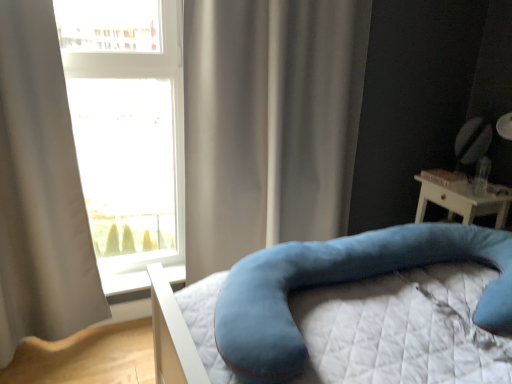
Identify the location of satin beige curtain at center, which ranks as the first curtain in right-to-left order. This screenshot has width=512, height=384. (269, 123).

The height and width of the screenshot is (384, 512). Identify the location of transparent glass window at upper left. (128, 133).

The height and width of the screenshot is (384, 512). What are the coordinates of `white plastic window sill at lower left` in the screenshot? It's located at (128, 287).

Which of these two, satin beige curtain at center, which ranks as the first curtain in right-to-left order, or transparent glass window at upper left, is thinner?

With smaller width is transparent glass window at upper left.

Is satin beige curtain at center, the second curtain viewed from the left, facing away from transparent glass window at upper left?

satin beige curtain at center, the second curtain viewed from the left, is not turned away from transparent glass window at upper left.

Locate an element on the screen. Image resolution: width=512 pixels, height=384 pixels. the 1st curtain in front of the transparent glass window at upper left, starting your count from the anchor is located at coordinates (269, 123).

Considering the sizes of objects satin beige curtain at center, which ranks as the first curtain in right-to-left order, and transparent glass window at upper left in the image provided, who is smaller, satin beige curtain at center, which ranks as the first curtain in right-to-left order, or transparent glass window at upper left?

transparent glass window at upper left.

Which is closer to the camera, (x=89, y=72) or (x=437, y=237)?

Point (x=89, y=72) appears to be farther away from the viewer than point (x=437, y=237).

Considering the relative sizes of transparent glass window at upper left and velvety blue pillow at lower right in the image provided, is transparent glass window at upper left thinner than velvety blue pillow at lower right?

Yes, transparent glass window at upper left is thinner than velvety blue pillow at lower right.

Is transparent glass window at upper left further to the viewer compared to velvety blue pillow at lower right?

Yes, transparent glass window at upper left is further from the viewer.

Which object is positioned more to the right, light gray fabric curtain at left, which appears as the first curtain when viewed from the left, or velvety blue pillow at lower right?

Positioned to the right is velvety blue pillow at lower right.

Considering the relative sizes of light gray fabric curtain at left, which appears as the first curtain when viewed from the left, and velvety blue pillow at lower right in the image provided, is light gray fabric curtain at left, which appears as the first curtain when viewed from the left, thinner than velvety blue pillow at lower right?

Indeed, light gray fabric curtain at left, which appears as the first curtain when viewed from the left, has a lesser width compared to velvety blue pillow at lower right.

Which point is more distant from viewer, [202,71] or [0,118]?

Point [202,71]

Can you confirm if satin beige curtain at center, the second curtain viewed from the left, is shorter than light gray fabric curtain at left, which appears as the first curtain when viewed from the left?

Indeed, satin beige curtain at center, the second curtain viewed from the left, has a lesser height compared to light gray fabric curtain at left, which appears as the first curtain when viewed from the left.

Is satin beige curtain at center, the second curtain viewed from the left, to the left or to the right of light gray fabric curtain at left, which appears as the first curtain when viewed from the left, in the image?

In the image, satin beige curtain at center, the second curtain viewed from the left, appears on the right side of light gray fabric curtain at left, which appears as the first curtain when viewed from the left.

Considering the relative sizes of light gray fabric curtain at left, which ranks as the 2th curtain in right-to-left order, and transparent glass window at upper left in the image provided, is light gray fabric curtain at left, which ranks as the 2th curtain in right-to-left order, wider than transparent glass window at upper left?

Indeed, light gray fabric curtain at left, which ranks as the 2th curtain in right-to-left order, has a greater width compared to transparent glass window at upper left.

Does light gray fabric curtain at left, which ranks as the 2th curtain in right-to-left order, have a smaller size compared to transparent glass window at upper left?

Actually, light gray fabric curtain at left, which ranks as the 2th curtain in right-to-left order, might be larger than transparent glass window at upper left.

From the image's perspective, is light gray fabric curtain at left, which appears as the first curtain when viewed from the left, above or below transparent glass window at upper left?

light gray fabric curtain at left, which appears as the first curtain when viewed from the left, is situated lower than transparent glass window at upper left in the image.

Does transparent glass window at upper left come behind white plastic window sill at lower left?

No, it is not.

Does point (83, 60) come closer to viewer compared to point (113, 284)?

That is True.

Is transparent glass window at upper left far from white plastic window sill at lower left?

Indeed, transparent glass window at upper left is not near white plastic window sill at lower left.

Looking at the image, does transparent glass window at upper left seem bigger or smaller compared to white plastic window sill at lower left?

transparent glass window at upper left is bigger than white plastic window sill at lower left.

Between velvety blue pillow at lower right and satin beige curtain at center, which ranks as the first curtain in right-to-left order, which one has larger size?

Result: Bigger between the two is satin beige curtain at center, which ranks as the first curtain in right-to-left order.

Can you confirm if velvety blue pillow at lower right is shorter than satin beige curtain at center, the second curtain viewed from the left?

Yes, velvety blue pillow at lower right is shorter than satin beige curtain at center, the second curtain viewed from the left.

Considering the positions of objects velvety blue pillow at lower right and satin beige curtain at center, which ranks as the first curtain in right-to-left order, in the image provided, who is in front, velvety blue pillow at lower right or satin beige curtain at center, which ranks as the first curtain in right-to-left order,?

velvety blue pillow at lower right.

From the image's perspective, is velvety blue pillow at lower right beneath satin beige curtain at center, the second curtain viewed from the left?

Correct, velvety blue pillow at lower right appears lower than satin beige curtain at center, the second curtain viewed from the left, in the image.

Where is `the 1st curtain in front of the transparent glass window at upper left`? The width and height of the screenshot is (512, 384). the 1st curtain in front of the transparent glass window at upper left is located at coordinates (269, 123).

This screenshot has width=512, height=384. What are the coordinates of `window that appears behind the velvety blue pillow at lower right` in the screenshot? It's located at (128, 133).

Estimate the real-world distances between objects in this image. Which object is further from transparent glass window at upper left, satin beige curtain at center, the second curtain viewed from the left, or velvety blue pillow at lower right?

velvety blue pillow at lower right.

Estimate the real-world distances between objects in this image. Which object is closer to light gray fabric curtain at left, which ranks as the 2th curtain in right-to-left order, transparent glass window at upper left or satin beige curtain at center, which ranks as the first curtain in right-to-left order?

satin beige curtain at center, which ranks as the first curtain in right-to-left order, lies closer to light gray fabric curtain at left, which ranks as the 2th curtain in right-to-left order, than the other object.

Based on their spatial positions, is satin beige curtain at center, which ranks as the first curtain in right-to-left order, or transparent glass window at upper left closer to white plastic window sill at lower left?

satin beige curtain at center, which ranks as the first curtain in right-to-left order, lies closer to white plastic window sill at lower left than the other object.

Looking at the image, which one is located closer to satin beige curtain at center, which ranks as the first curtain in right-to-left order, white plastic window sill at lower left or light gray fabric curtain at left, which ranks as the 2th curtain in right-to-left order?

Among the two, white plastic window sill at lower left is located nearer to satin beige curtain at center, which ranks as the first curtain in right-to-left order.

When comparing their distances from white plastic window sill at lower left, does light gray fabric curtain at left, which ranks as the 2th curtain in right-to-left order, or transparent glass window at upper left seem closer?

light gray fabric curtain at left, which ranks as the 2th curtain in right-to-left order, is positioned closer to the anchor white plastic window sill at lower left.

Looking at this image, estimate the real-world distances between objects in this image. Which object is closer to velvety blue pillow at lower right, light gray fabric curtain at left, which ranks as the 2th curtain in right-to-left order, or satin beige curtain at center, which ranks as the first curtain in right-to-left order?

satin beige curtain at center, which ranks as the first curtain in right-to-left order, is positioned closer to the anchor velvety blue pillow at lower right.

Based on their spatial positions, is transparent glass window at upper left or light gray fabric curtain at left, which ranks as the 2th curtain in right-to-left order, closer to satin beige curtain at center, which ranks as the first curtain in right-to-left order?

light gray fabric curtain at left, which ranks as the 2th curtain in right-to-left order, is closer to satin beige curtain at center, which ranks as the first curtain in right-to-left order.

Based on their spatial positions, is transparent glass window at upper left or light gray fabric curtain at left, which ranks as the 2th curtain in right-to-left order, further from velvety blue pillow at lower right?

transparent glass window at upper left is further to velvety blue pillow at lower right.

The height and width of the screenshot is (384, 512). Identify the location of window between light gray fabric curtain at left, which ranks as the 2th curtain in right-to-left order, and velvety blue pillow at lower right, in the horizontal direction. (128, 133).

Image resolution: width=512 pixels, height=384 pixels. I want to click on window sill between light gray fabric curtain at left, which ranks as the 2th curtain in right-to-left order, and satin beige curtain at center, the second curtain viewed from the left, in the horizontal direction, so click(x=128, y=287).

The image size is (512, 384). Identify the location of window sill between light gray fabric curtain at left, which appears as the first curtain when viewed from the left, and velvety blue pillow at lower right. (128, 287).

Identify the location of curtain between transparent glass window at upper left and velvety blue pillow at lower right in the horizontal direction. Image resolution: width=512 pixels, height=384 pixels. (269, 123).